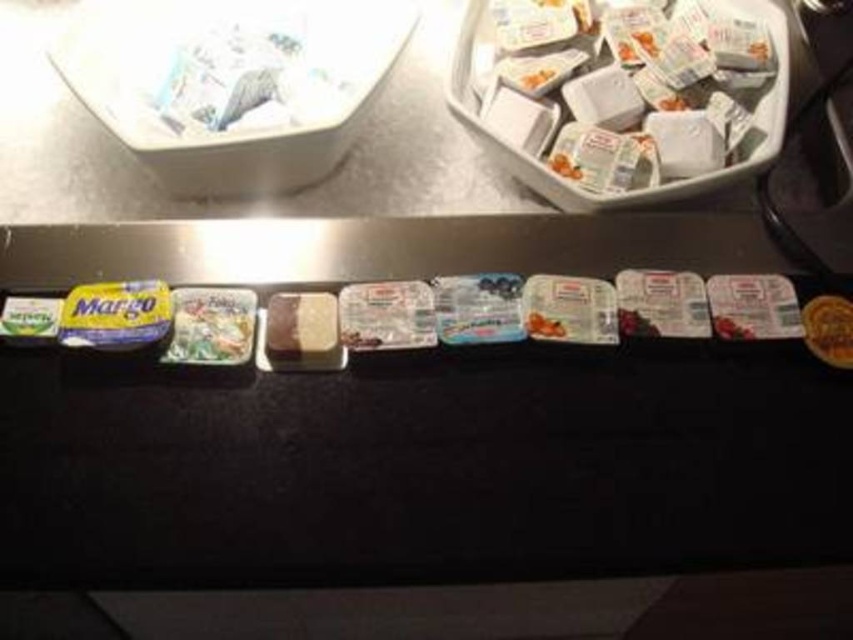
How much distance is there between white plastic containers at upper right and white paper bag at upper left?

white plastic containers at upper right is 10.82 inches away from white paper bag at upper left.

Can you confirm if white plastic containers at upper right is taller than white paper bag at upper left?

Yes.

This screenshot has height=640, width=853. I want to click on white plastic containers at upper right, so click(685, 65).

This screenshot has height=640, width=853. In order to click on white plastic containers at upper right in this screenshot , I will do `click(685, 65)`.